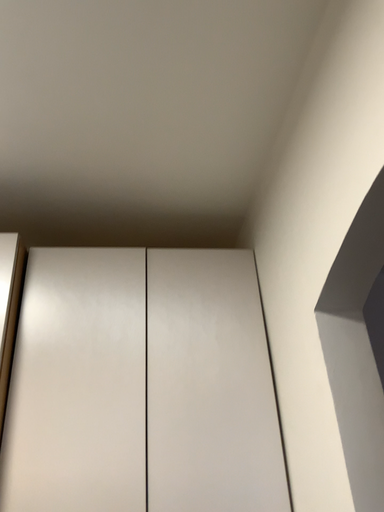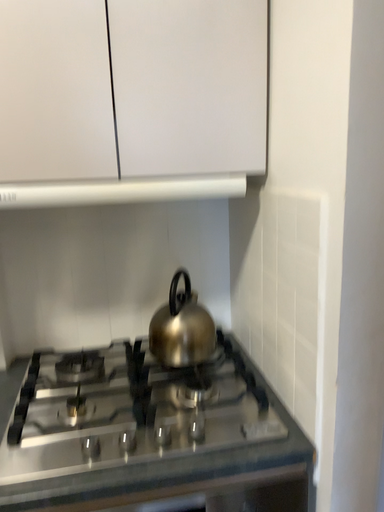
Question: Which way did the camera rotate in the video?

Choices:
 (A) rotated upward
 (B) rotated downward

Answer: (B)